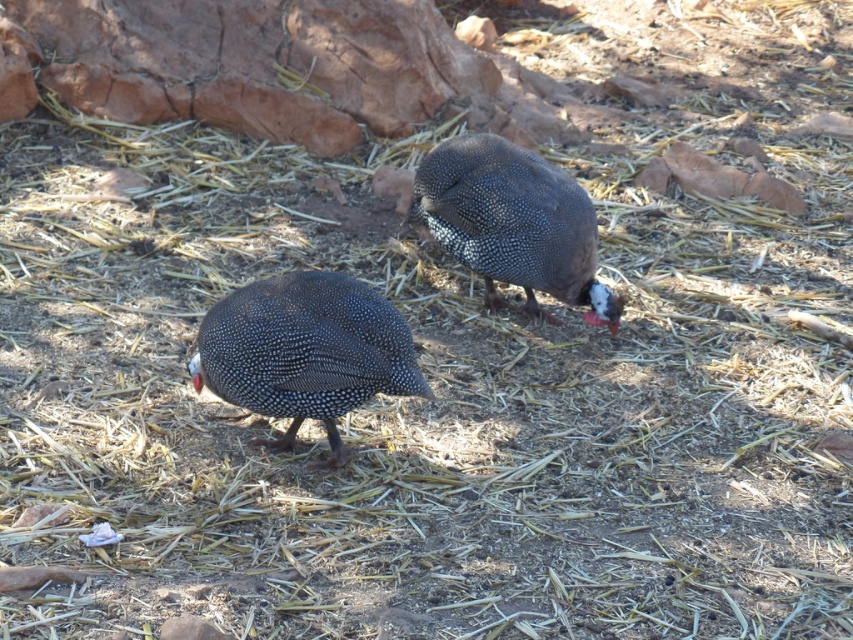
Looking at this image, is speckled feathered guinea fowl at center to the right of speckled dark brown guinea fowl at center from the viewer's perspective?

Incorrect, speckled feathered guinea fowl at center is not on the right side of speckled dark brown guinea fowl at center.

Does speckled feathered guinea fowl at center appear under speckled dark brown guinea fowl at center?

Yes, speckled feathered guinea fowl at center is below speckled dark brown guinea fowl at center.

Locate an element on the screen. speckled feathered guinea fowl at center is located at coordinates (305, 352).

You are a GUI agent. You are given a task and a screenshot of the screen. Output one action in this format:
    pyautogui.click(x=<x>, y=<y>)
    Task: Click on the speckled feathered guinea fowl at center
    
    Given the screenshot: What is the action you would take?
    pyautogui.click(x=305, y=352)